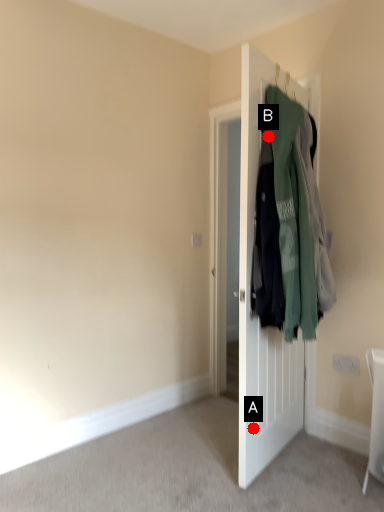
Question: Two points are circled on the image, labeled by A and B beside each circle. Which point is farther from the camera taking this photo?

Choices:
 (A) A is further
 (B) B is further

Answer: (A)